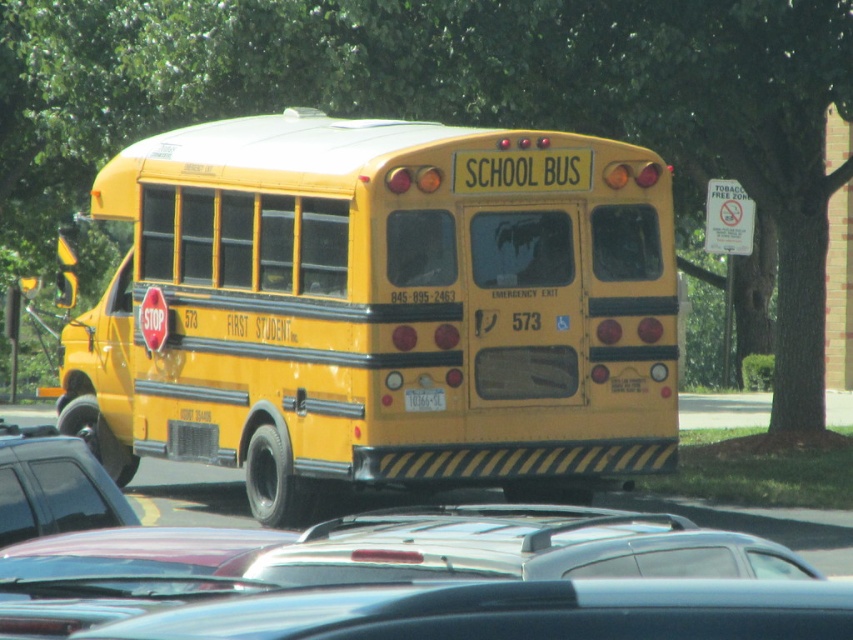
Question: Is matte yellow school bus at center further to the viewer compared to metallic gray sedan at center?

Choices:
 (A) no
 (B) yes

Answer: (B)

Question: Is the position of matte yellow school bus at center more distant than that of yellow matte license plate at center?

Choices:
 (A) no
 (B) yes

Answer: (A)

Question: Among these objects, which one is farthest from the camera?

Choices:
 (A) matte yellow school bus at center
 (B) yellow matte license plate at center

Answer: (B)

Question: Which is nearer to the metallic gray sedan at center?

Choices:
 (A) yellow matte license plate at center
 (B) matte yellow school bus at center

Answer: (A)

Question: Does matte yellow school bus at center have a smaller size compared to metallic gray sedan at center?

Choices:
 (A) no
 (B) yes

Answer: (A)

Question: Which object is farther from the camera taking this photo?

Choices:
 (A) yellow matte license plate at center
 (B) matte yellow school bus at center
 (C) metallic gray sedan at center

Answer: (A)